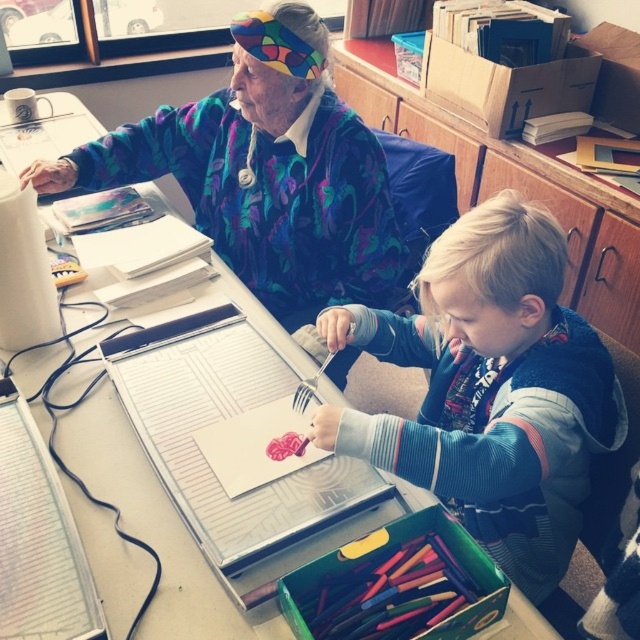
Question: Can you confirm if blue fleece sweater at center is positioned to the right of multicolored wax crayons at lower center?

Choices:
 (A) yes
 (B) no

Answer: (A)

Question: Which object is the closest to the floral sweater at upper left?

Choices:
 (A) multicolored wax crayons at lower center
 (B) blue fleece sweater at center

Answer: (B)

Question: Is blue fleece sweater at center behind floral sweater at upper left?

Choices:
 (A) yes
 (B) no

Answer: (B)

Question: Is blue fleece sweater at center above floral sweater at upper left?

Choices:
 (A) no
 (B) yes

Answer: (A)

Question: Which of the following is the closest to the observer?

Choices:
 (A) floral sweater at upper left
 (B) multicolored wax crayons at lower center

Answer: (B)

Question: Among these points, which one is nearest to the camera?

Choices:
 (A) (317, 634)
 (B) (417, 460)

Answer: (A)